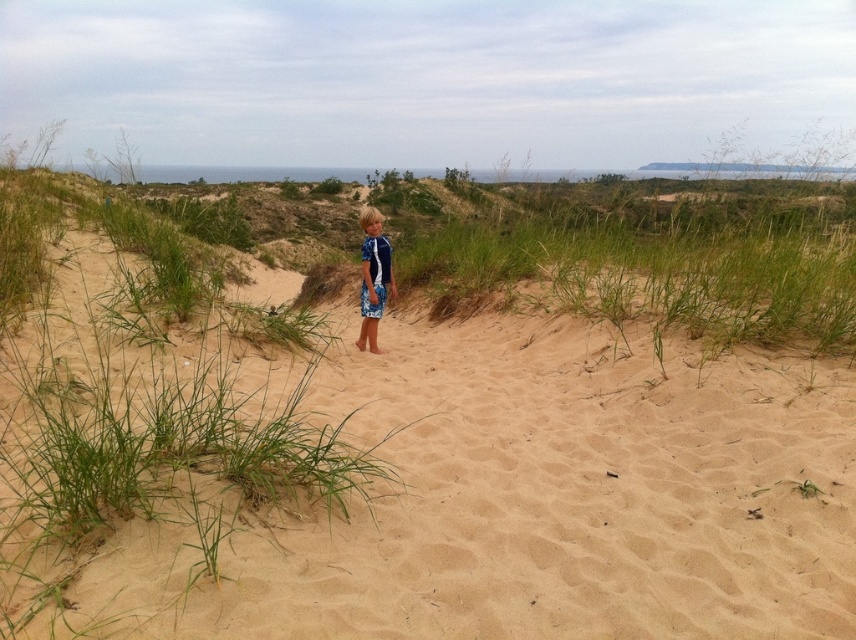
Question: Is sandy tan sand at center to the left of blue printed rash guard at center from the viewer's perspective?

Choices:
 (A) yes
 (B) no

Answer: (A)

Question: Is sandy tan sand at center wider than blue printed rash guard at center?

Choices:
 (A) yes
 (B) no

Answer: (B)

Question: Which point is closer to the camera?

Choices:
 (A) sandy tan sand at center
 (B) blue printed rash guard at center

Answer: (A)

Question: Can you confirm if sandy tan sand at center is positioned above blue printed rash guard at center?

Choices:
 (A) no
 (B) yes

Answer: (A)

Question: Which point appears closest to the camera in this image?

Choices:
 (A) (232, 390)
 (B) (391, 292)

Answer: (A)